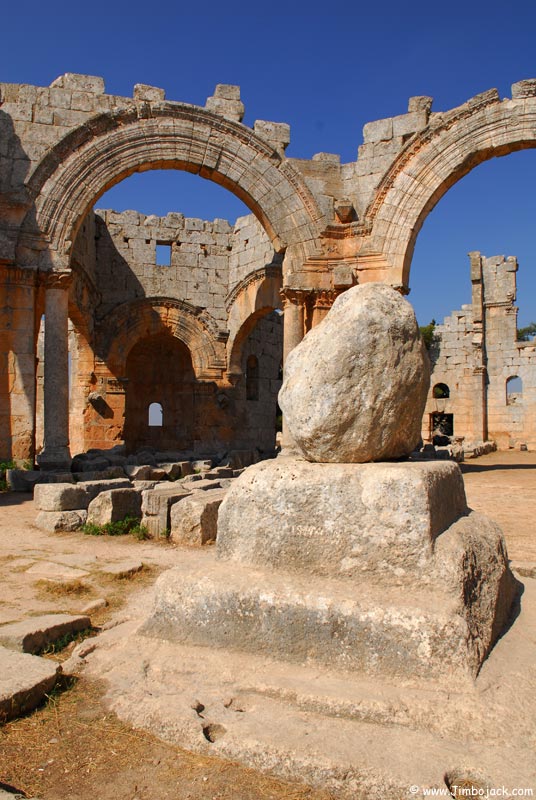
Locate an element on the screen. wall is located at coordinates (193, 285).